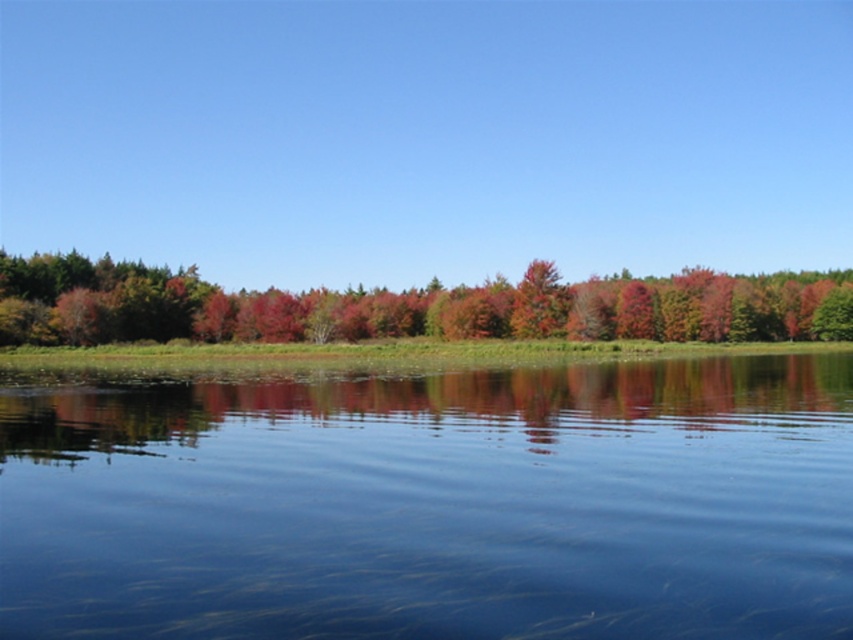
You are standing on a path that runs parallel to the water. You see the transparent water at center and the green matte tree at center. Which object is closer to your right side?

The green matte tree at center is closer to your right side because the transparent water at center is to the left of it.

You are standing on the bank of the lake and notice the transparent water at center and the shiny red tree at center. Which object appears taller from your viewpoint?

The shiny red tree at center appears taller than the transparent water at center because the transparent water at center has a lesser height compared to the shiny red tree at center.